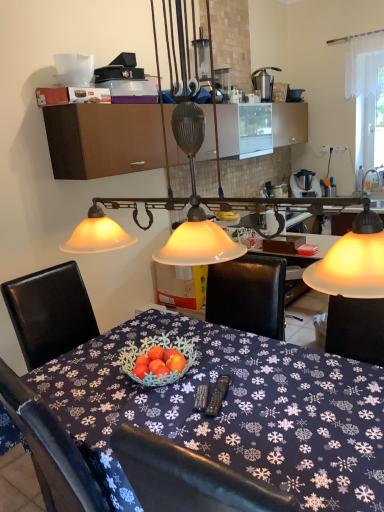
What is the approximate height of metallic silver blender at right?

It is 14.69 inches.

What is the approximate width of metallic silver blender at right?

metallic silver blender at right is 13.08 inches in width.

What do you see at coordinates (264, 82) in the screenshot? I see `metallic silver juicer at upper right` at bounding box center [264, 82].

This screenshot has height=512, width=384. What do you see at coordinates (366, 176) in the screenshot?
I see `brushed metal faucet at upper right` at bounding box center [366, 176].

This screenshot has height=512, width=384. Describe the element at coordinates (230, 411) in the screenshot. I see `blue fabric tablecloth at center` at that location.

The width and height of the screenshot is (384, 512). I want to click on metallic silver blender at right, so click(x=304, y=184).

Is metallic silver blender at right looking in the opposite direction of white sheer curtain at upper right?

No.

Where is `appliance below the white sheer curtain at upper right (from the image's perspective)`? Image resolution: width=384 pixels, height=512 pixels. appliance below the white sheer curtain at upper right (from the image's perspective) is located at coordinates (304, 184).

From a real-world perspective, is metallic silver blender at right beneath white sheer curtain at upper right?

Indeed, from a real-world perspective, metallic silver blender at right is positioned beneath white sheer curtain at upper right.

Considering the points (315, 177) and (376, 38), which point is in front, point (315, 177) or point (376, 38)?

The point (376, 38) is more forward.

Can you confirm if brown matte cabinet at upper center is bigger than blue fabric tablecloth at center?

Incorrect, brown matte cabinet at upper center is not larger than blue fabric tablecloth at center.

Could you tell me if brown matte cabinet at upper center is turned towards blue fabric tablecloth at center?

No, brown matte cabinet at upper center is not aimed at blue fabric tablecloth at center.

Is brown matte cabinet at upper center taller than blue fabric tablecloth at center?

No, brown matte cabinet at upper center is not taller than blue fabric tablecloth at center.

From a real-world perspective, relative to blue fabric tablecloth at center, is brown matte cabinet at upper center vertically above or below?

Clearly, from a real-world perspective, brown matte cabinet at upper center is above blue fabric tablecloth at center.

From the image's perspective, is brown matte cabinet at upper center located above brushed metal faucet at upper right?

Indeed, from the image's perspective, brown matte cabinet at upper center is shown above brushed metal faucet at upper right.

How different are the orientations of brown matte cabinet at upper center and brushed metal faucet at upper right in degrees?

brown matte cabinet at upper center and brushed metal faucet at upper right are facing 178 degrees away from each other.

Consider the image. Who is bigger, brown matte cabinet at upper center or brushed metal faucet at upper right?

With larger size is brown matte cabinet at upper center.

Is brown matte cabinet at upper center not inside brushed metal faucet at upper right?

brown matte cabinet at upper center lies outside brushed metal faucet at upper right's area.

From the image's perspective, is metallic silver blender at right positioned above or below blue fabric tablecloth at center?

From the image's perspective, metallic silver blender at right appears above blue fabric tablecloth at center.

From a real-world perspective, between metallic silver blender at right and blue fabric tablecloth at center, who is vertically higher?

metallic silver blender at right is physically above.

Does point (299, 174) lie in front of point (369, 416)?

No, (299, 174) is behind (369, 416).

Consider the image. What's the angular difference between metallic silver blender at right and blue fabric tablecloth at center's facing directions?

There is a 40.8-degree angle between the facing directions of metallic silver blender at right and blue fabric tablecloth at center.

Are white sheer curtain at upper right and blue fabric tablecloth at center beside each other?

There is a gap between white sheer curtain at upper right and blue fabric tablecloth at center.

Considering the positions of objects white sheer curtain at upper right and blue fabric tablecloth at center in the image provided, who is more to the right, white sheer curtain at upper right or blue fabric tablecloth at center?

white sheer curtain at upper right.

From a real-world perspective, is white sheer curtain at upper right located higher than blue fabric tablecloth at center?

Yes.

Is white sheer curtain at upper right completely or partially outside of blue fabric tablecloth at center?

Yes, white sheer curtain at upper right is located beyond the bounds of blue fabric tablecloth at center.

How many degrees apart are the facing directions of brushed metal faucet at upper right and white sheer curtain at upper right?

The angular difference between brushed metal faucet at upper right and white sheer curtain at upper right is 178 degrees.

Is brushed metal faucet at upper right in contact with white sheer curtain at upper right?

There is a gap between brushed metal faucet at upper right and white sheer curtain at upper right.

Can you confirm if brushed metal faucet at upper right is thinner than white sheer curtain at upper right?

Indeed, brushed metal faucet at upper right has a lesser width compared to white sheer curtain at upper right.

From the image's perspective, is brushed metal faucet at upper right over white sheer curtain at upper right?

No, from the image's perspective, brushed metal faucet at upper right is not on top of white sheer curtain at upper right.

What are the coordinates of `tableware behind the blue fabric tablecloth at center` in the screenshot? It's located at (264, 82).

From the image's perspective, is metallic silver juicer at upper right beneath blue fabric tablecloth at center?

No, from the image's perspective, metallic silver juicer at upper right is not beneath blue fabric tablecloth at center.

What's the angular difference between metallic silver juicer at upper right and blue fabric tablecloth at center's facing directions?

3.33 degrees.

Does metallic silver juicer at upper right touch blue fabric tablecloth at center?

metallic silver juicer at upper right is not next to blue fabric tablecloth at center, and they're not touching.

What are the coordinates of `appliance below the white sheer curtain at upper right (from the image's perspective)` in the screenshot? It's located at (304, 184).

There is a blue fabric tablecloth at center. At what (x,y) coordinates should I click in order to perform the action: click on cabinetry above it (from a real-world perspective). Please return your answer as a coordinate pair (x, y). This screenshot has height=512, width=384. Looking at the image, I should click on (103, 139).

Looking at the image, which one is located further to blue fabric tablecloth at center, metallic silver juicer at upper right or brown matte cabinet at upper center?

metallic silver juicer at upper right lies further to blue fabric tablecloth at center than the other object.

Based on their spatial positions, is brown matte cabinet at upper center or white sheer curtain at upper right closer to brushed metal faucet at upper right?

Based on the image, white sheer curtain at upper right appears to be nearer to brushed metal faucet at upper right.

Looking at the image, which one is located closer to brown matte cabinet at upper center, brushed metal faucet at upper right or metallic silver juicer at upper right?

metallic silver juicer at upper right.

Estimate the real-world distances between objects in this image. Which object is further from white sheer curtain at upper right, brown matte cabinet at upper center or metallic silver blender at right?

brown matte cabinet at upper center lies further to white sheer curtain at upper right than the other object.

Based on their spatial positions, is metallic silver blender at right or blue fabric tablecloth at center further from brown matte cabinet at upper center?

metallic silver blender at right lies further to brown matte cabinet at upper center than the other object.

Based on the photo, when comparing their distances from white sheer curtain at upper right, does metallic silver juicer at upper right or brushed metal faucet at upper right seem further?

brushed metal faucet at upper right is further to white sheer curtain at upper right.

Estimate the real-world distances between objects in this image. Which object is further from white sheer curtain at upper right, metallic silver blender at right or metallic silver juicer at upper right?

metallic silver blender at right lies further to white sheer curtain at upper right than the other object.

From the picture: Considering their positions, is blue fabric tablecloth at center positioned closer to metallic silver juicer at upper right than metallic silver blender at right?

metallic silver blender at right is positioned closer to the anchor metallic silver juicer at upper right.

At what (x,y) coordinates should I click in order to perform the action: click on faucet that lies between white sheer curtain at upper right and metallic silver blender at right from top to bottom. Please return your answer as a coordinate pair (x, y). Looking at the image, I should click on (366, 176).

This screenshot has height=512, width=384. Identify the location of faucet between blue fabric tablecloth at center and metallic silver blender at right from front to back. (366, 176).

Locate an element on the screen. The height and width of the screenshot is (512, 384). tableware between white sheer curtain at upper right and metallic silver blender at right in the up-down direction is located at coordinates (264, 82).

Where is `curtain positioned between blue fabric tablecloth at center and brushed metal faucet at upper right from near to far`? curtain positioned between blue fabric tablecloth at center and brushed metal faucet at upper right from near to far is located at coordinates (363, 64).